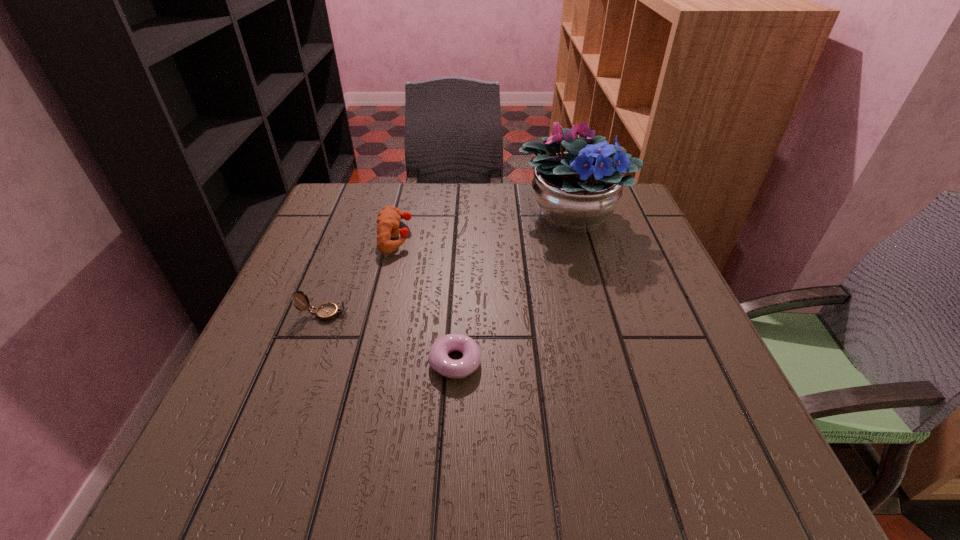
Where is `vacant point located 0.260m on the face of the leftmost object`? The height and width of the screenshot is (540, 960). vacant point located 0.260m on the face of the leftmost object is located at coordinates (481, 314).

Identify the location of free space located 0.220m on the left of the nearest object. (305, 362).

At what (x,y) coordinates should I click in order to perform the action: click on bouquet present at the far edge. Please return your answer as a coordinate pair (x, y). Image resolution: width=960 pixels, height=540 pixels. Looking at the image, I should click on (576, 191).

Where is `puncher that is positioned at the far edge`? This screenshot has width=960, height=540. puncher that is positioned at the far edge is located at coordinates (388, 219).

Locate an element on the screen. The width and height of the screenshot is (960, 540). object located at the left edge is located at coordinates (327, 311).

Where is `object present at the right edge`? The width and height of the screenshot is (960, 540). object present at the right edge is located at coordinates (576, 191).

At what (x,y) coordinates should I click in order to perform the action: click on object positioned at the far right corner. Please return your answer as a coordinate pair (x, y). This screenshot has width=960, height=540. Looking at the image, I should click on (576, 191).

This screenshot has height=540, width=960. Find the location of `vacant space at the far edge of the desktop`. vacant space at the far edge of the desktop is located at coordinates (435, 198).

In the image, there is a desktop. Identify the location of vacant space at the near edge. (308, 483).

The width and height of the screenshot is (960, 540). In the image, there is a desktop. Identify the location of vacant area at the left edge. coord(331,346).